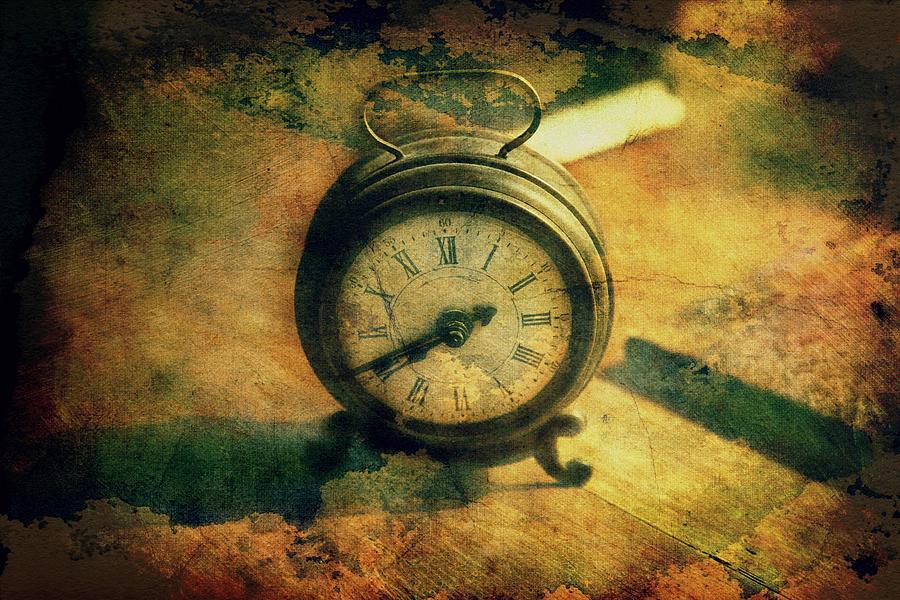
Where is `diagonal white inlay area of table`? The image size is (900, 600). diagonal white inlay area of table is located at coordinates (579, 140), (613, 126).